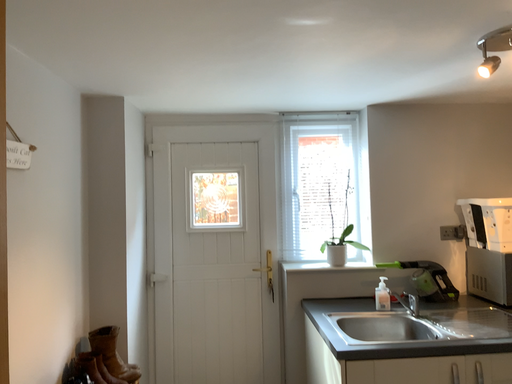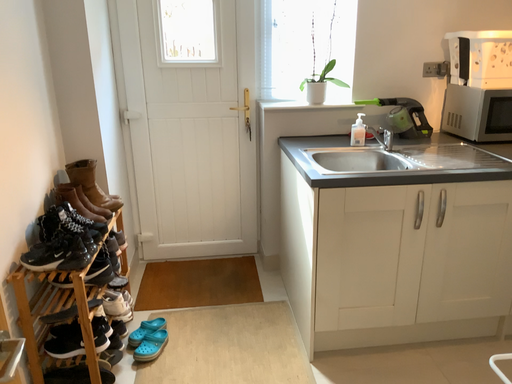
Question: Which way did the camera rotate in the video?

Choices:
 (A) rotated downward
 (B) rotated upward

Answer: (A)